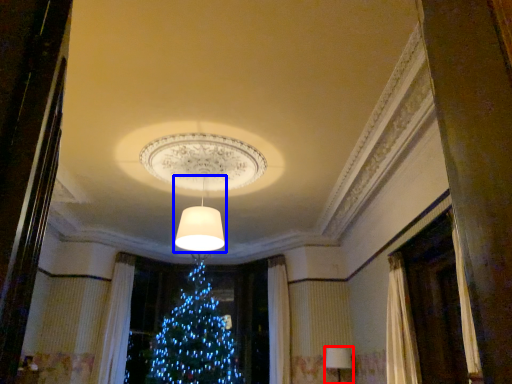
Question: Among these objects, which one is nearest to the camera, lamp (highlighted by a red box) or lamp (highlighted by a blue box)?

Choices:
 (A) lamp
 (B) lamp

Answer: (B)